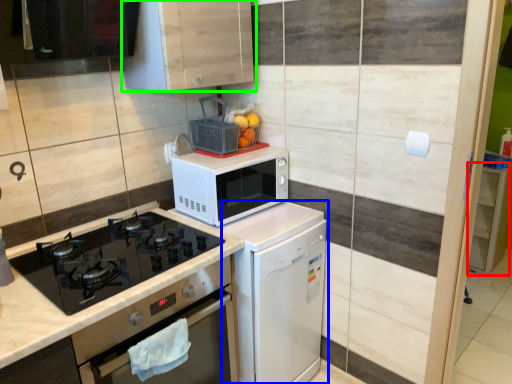
Question: Based on their relative distances, which object is nearer to cabinetry (highlighted by a red box)? Choose from dish washer (highlighted by a blue box) and cabinetry (highlighted by a green box).

Choices:
 (A) dish washer
 (B) cabinetry

Answer: (A)